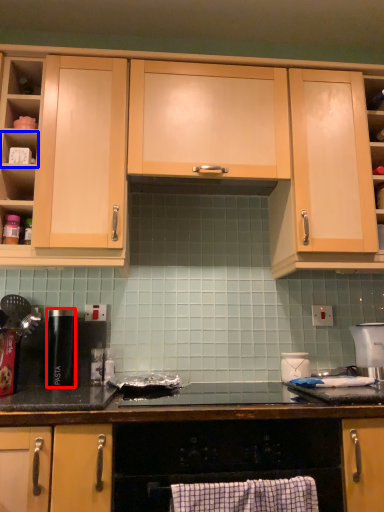
Question: Which of the following is the farthest to the observer, appliance (highlighted by a red box) or shelf (highlighted by a blue box)?

Choices:
 (A) appliance
 (B) shelf

Answer: (A)